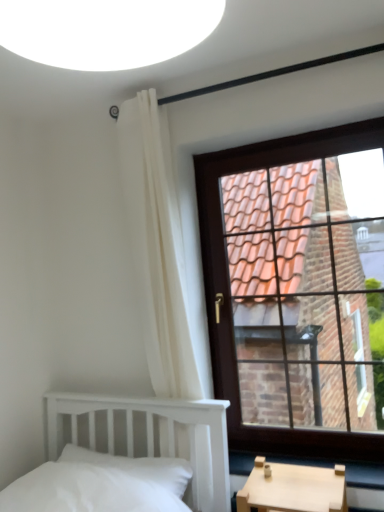
Question: Based on their positions, is brown wooden window at upper right located to the left or right of white soft pillow at lower left?

Choices:
 (A) left
 (B) right

Answer: (B)

Question: In the image, is brown wooden window at upper right positioned in front of or behind white soft pillow at lower left?

Choices:
 (A) behind
 (B) front

Answer: (A)

Question: Estimate the real-world distances between objects in this image. Which object is farther from the white fabric curtain at upper left?

Choices:
 (A) white soft pillow at lower left
 (B) brown wooden window at upper right

Answer: (B)

Question: Which object is the closest to the brown wooden window at upper right?

Choices:
 (A) white fabric curtain at upper left
 (B) white soft pillow at lower left

Answer: (A)